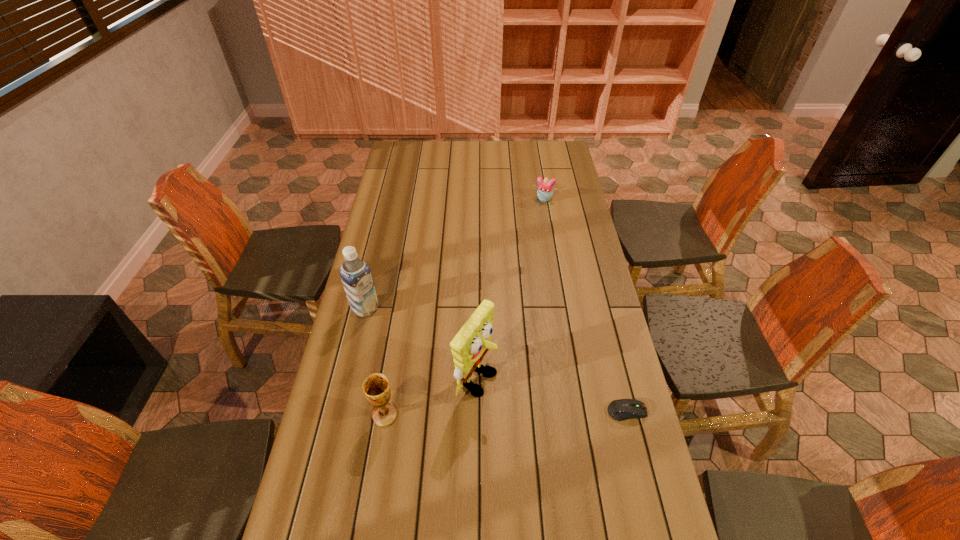
At what (x,y) coordinates should I click in order to perform the action: click on vacant space on the desktop that is between the third tallest object and the shortest object and is positioned on the label of the second farthest object. Please return your answer as a coordinate pair (x, y). This screenshot has width=960, height=540. Looking at the image, I should click on (519, 413).

Locate an element on the screen. The image size is (960, 540). vacant spot on the desktop that is between the fourth object from right to left and the rightmost object and is positioned on the face of the third object from right to left is located at coordinates (542, 413).

The image size is (960, 540). Find the location of `vacant space on the desktop that is between the fourth object from right to left and the rightmost object and is positioned on the face of the farthest object`. vacant space on the desktop that is between the fourth object from right to left and the rightmost object and is positioned on the face of the farthest object is located at coordinates (473, 414).